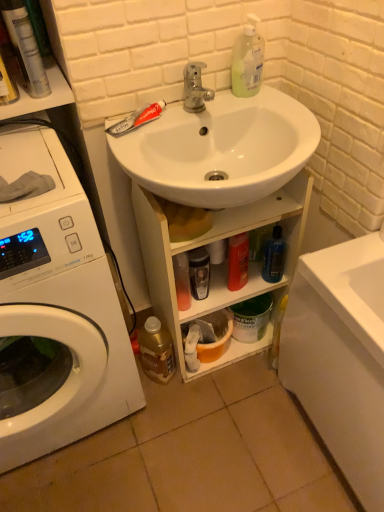
Locate an element on the screen. Image resolution: width=384 pixels, height=512 pixels. vacant region in front of white glossy cabinet at center is located at coordinates (230, 411).